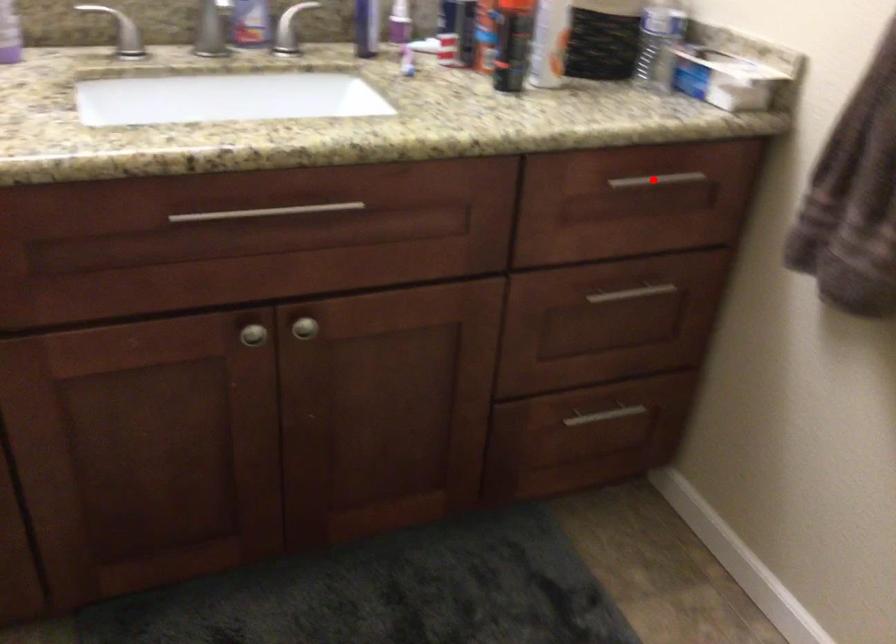
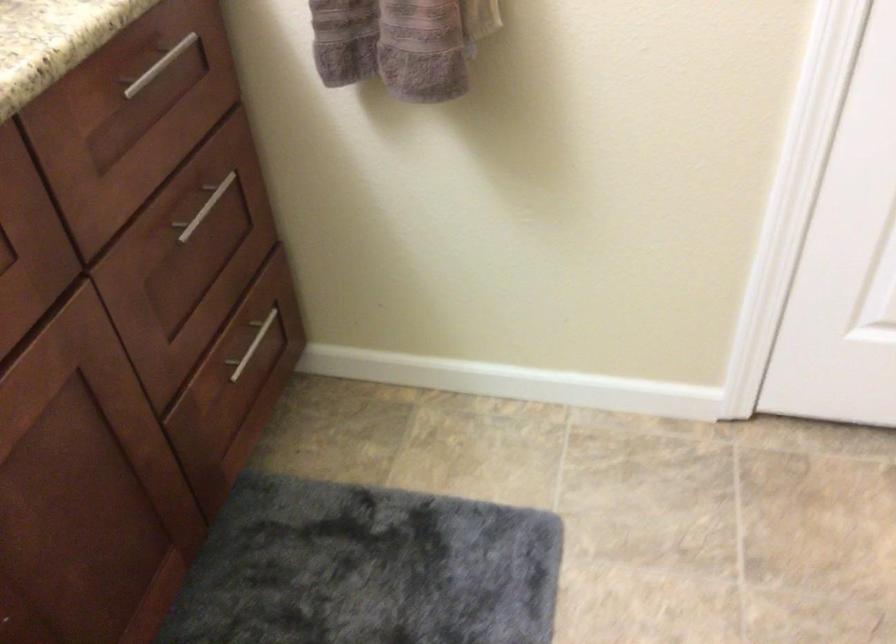
The point at the highlighted location is marked in the first image. Where is the corresponding point in the second image?

(159, 66)